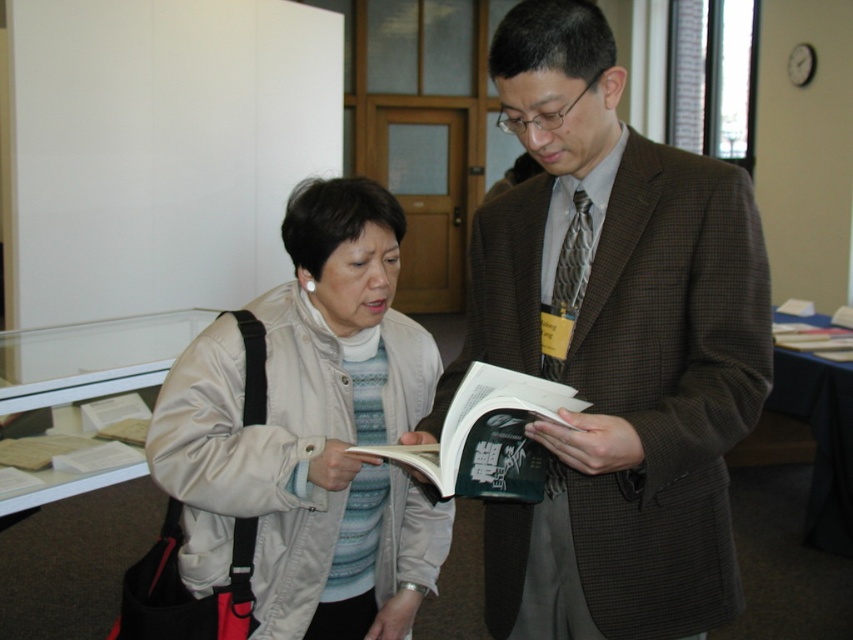
From the picture: You are a photographer standing 10 feet away from the brown checkered suit at center and the green matte book at center. You want to take a photo that includes both subjects without moving them. What is the minimum focal length lens you should use to ensure both are fully in frame?

The minimum focal length lens required is calculated using the distance between the subjects and the photographer. Given the 6.89 inches separation between the brown checkered suit at center and green matte book at center, and the photographer being 10 feet away, a lens with a focal length of approximately 50mm would suffice to capture both subjects within the frame.

You are standing in the library and need to find the brown checkered suit at center. According to the coordinates provided, where exactly should you look within the image?

The brown checkered suit at center is located at point coordinates 0.544 on the x axis and 0.720 on the y axis.